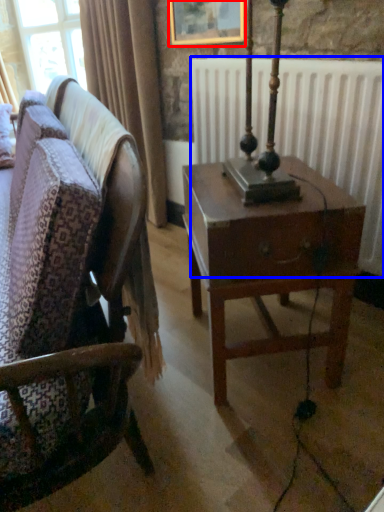
Question: Which object is further to the camera taking this photo, picture frame (highlighted by a red box) or radiator (highlighted by a blue box)?

Choices:
 (A) picture frame
 (B) radiator

Answer: (A)